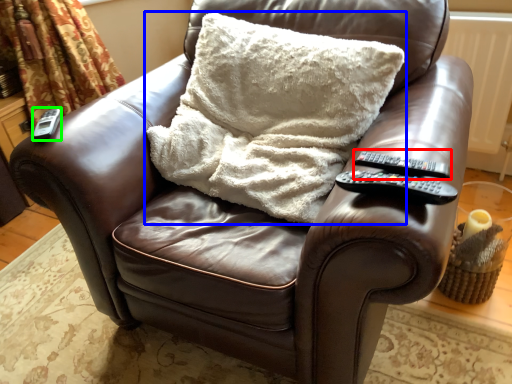
Question: Which is nearer to the remote (highlighted by a red box)? pillow (highlighted by a blue box) or remote (highlighted by a green box).

Choices:
 (A) pillow
 (B) remote

Answer: (A)